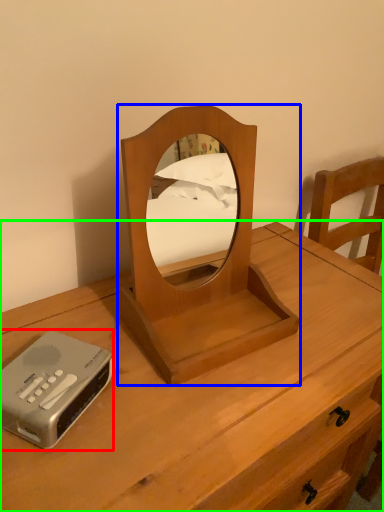
Question: Estimate the real-world distances between objects in this image. Which object is farther from cassette (highlighted by a red box), mirror (highlighted by a blue box) or nightstand (highlighted by a green box)?

Choices:
 (A) mirror
 (B) nightstand

Answer: (B)